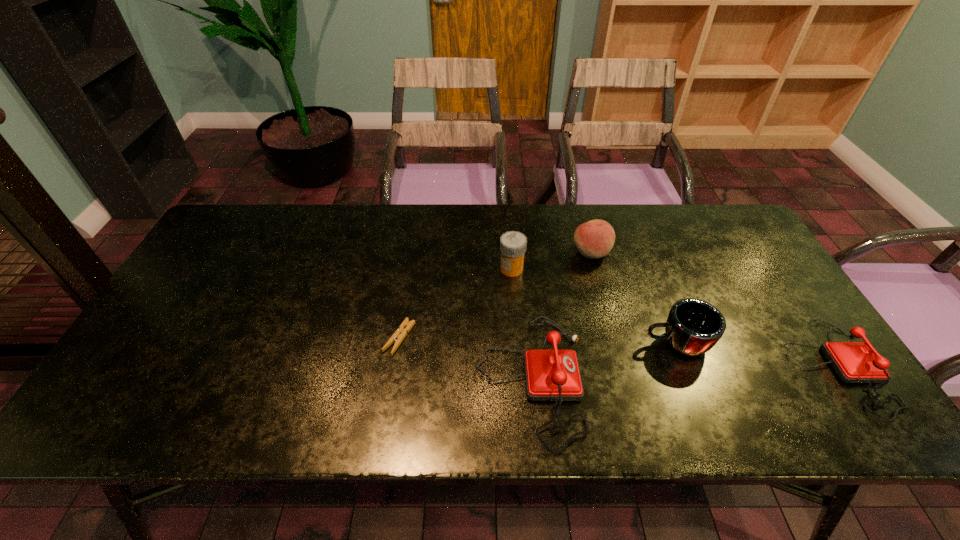
Where is `object at the near right corner`? object at the near right corner is located at coordinates (855, 362).

In the image, there is a desktop. Identify the location of vacant area at the far edge. (505, 214).

Locate an element on the screen. The width and height of the screenshot is (960, 540). vacant space at the near edge of the desktop is located at coordinates (416, 363).

The width and height of the screenshot is (960, 540). In the image, there is a desktop. Find the location of `vacant space at the right edge`. vacant space at the right edge is located at coordinates (807, 339).

Identify the location of free space at the far left corner. The image size is (960, 540). (222, 249).

In the image, there is a desktop. Identify the location of vacant region at the near left corner. This screenshot has height=540, width=960. (153, 375).

Image resolution: width=960 pixels, height=540 pixels. In the image, there is a desktop. Identify the location of free space at the far right corner. (721, 207).

Where is `blank region between the shortest object and the peach`? blank region between the shortest object and the peach is located at coordinates (495, 295).

The height and width of the screenshot is (540, 960). What are the coordinates of `free area in between the medicine and the leftmost object` in the screenshot? It's located at (456, 303).

Identify the location of unoccupied area between the shortest object and the fifth tallest object. This screenshot has width=960, height=540. (617, 352).